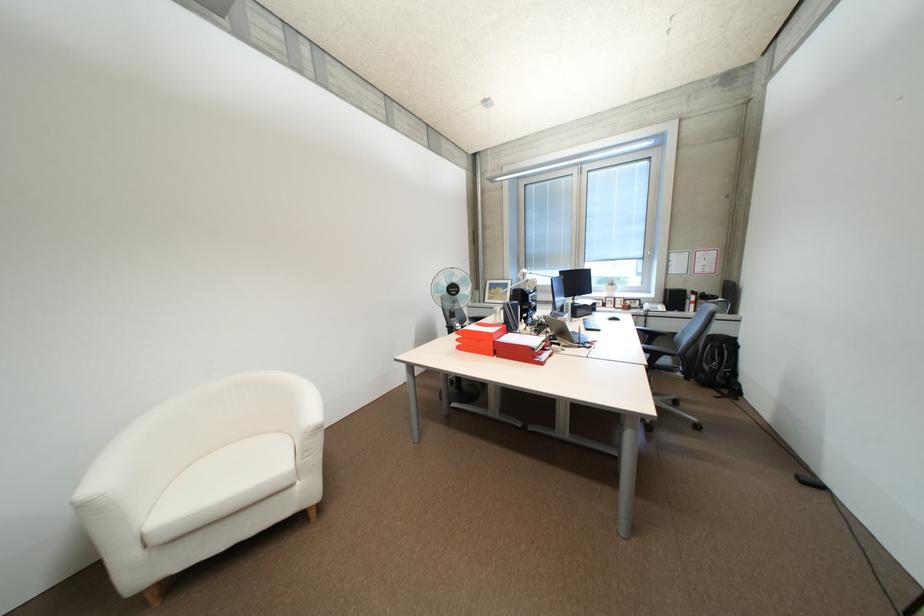
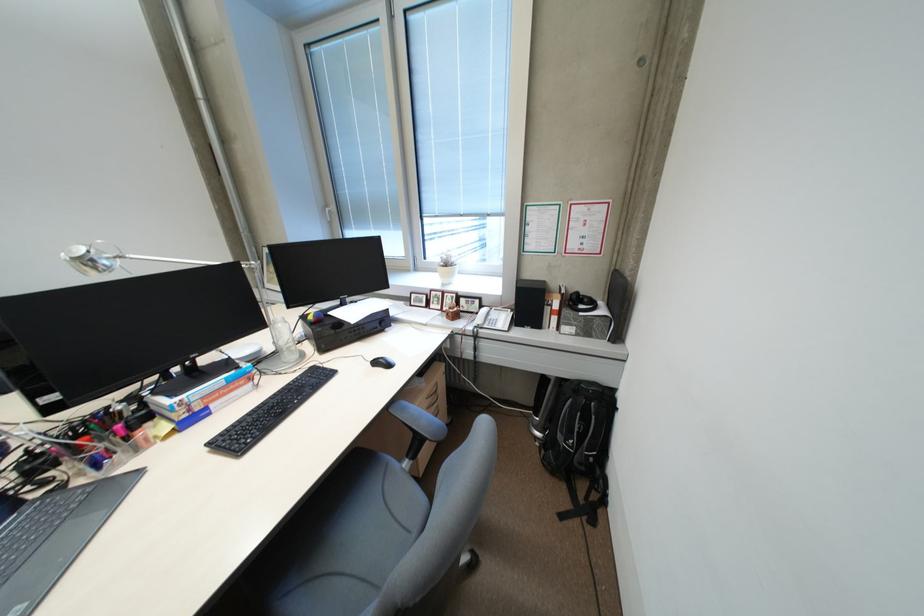
Find the pixel in the second image that matches (x=614, y=304) in the first image.

(438, 304)